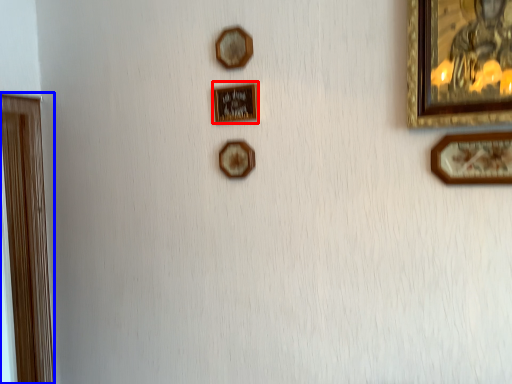
Question: Which point is further to the camera, picture frame (highlighted by a red box) or picture frame (highlighted by a blue box)?

Choices:
 (A) picture frame
 (B) picture frame

Answer: (B)